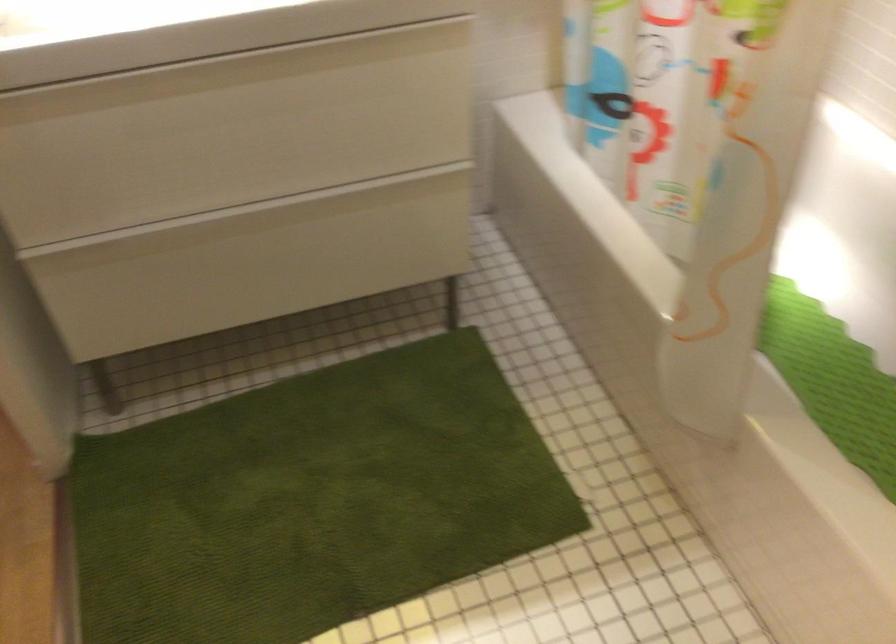
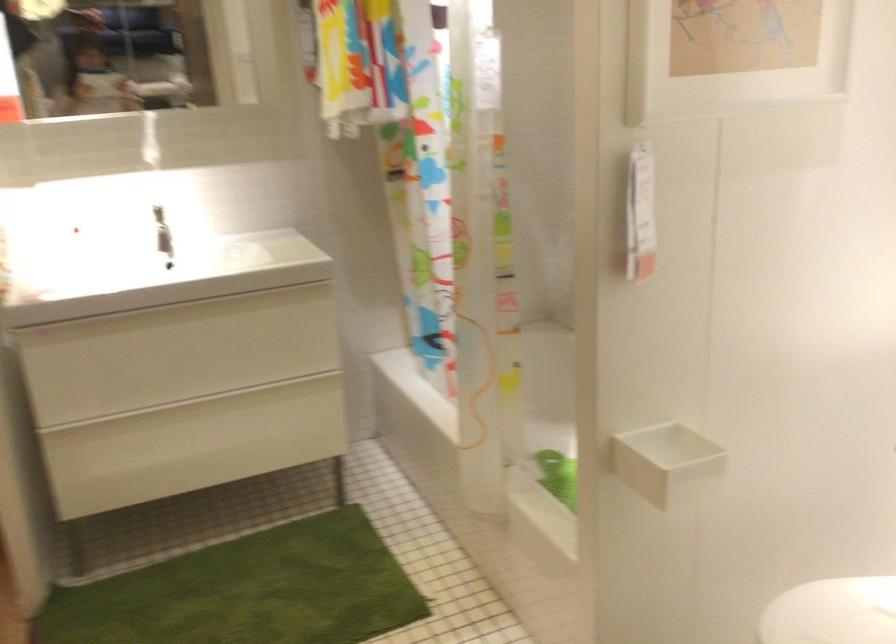
Question: The images are taken continuously from a first-person perspective. In which direction are you moving?

Choices:
 (A) Left
 (B) Right
 (C) Forward
 (D) Backward

Answer: (D)